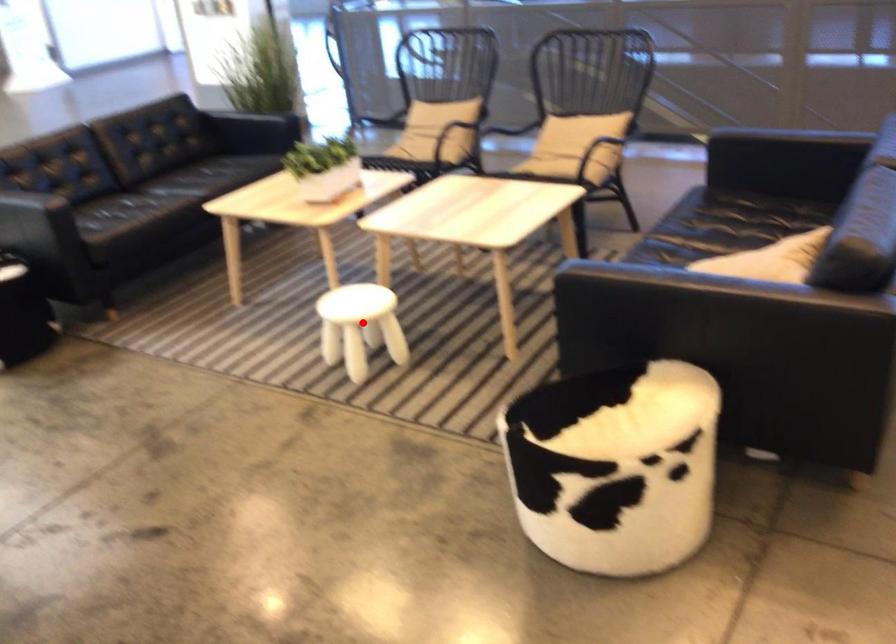
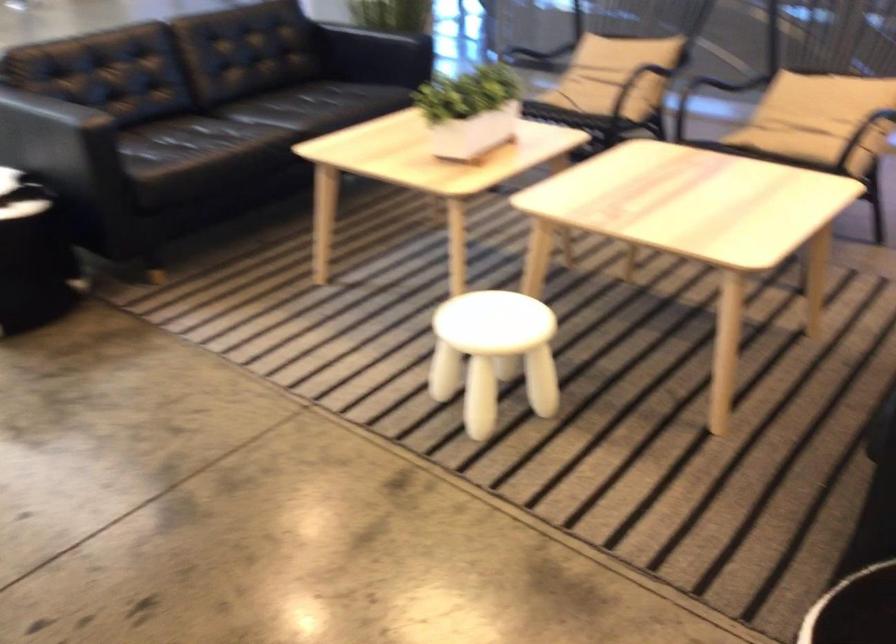
The point at the highlighted location is marked in the first image. Where is the corresponding point in the second image?

(493, 354)